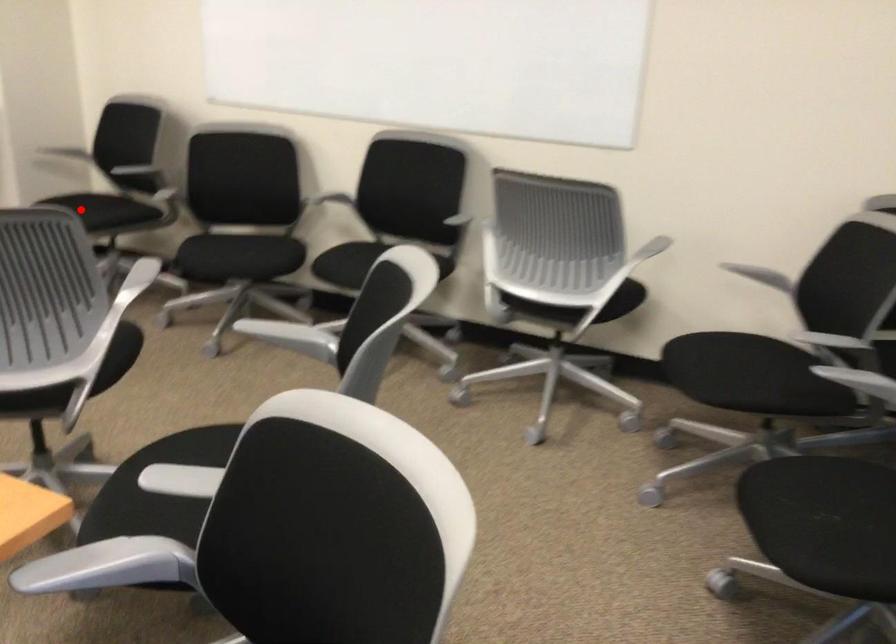
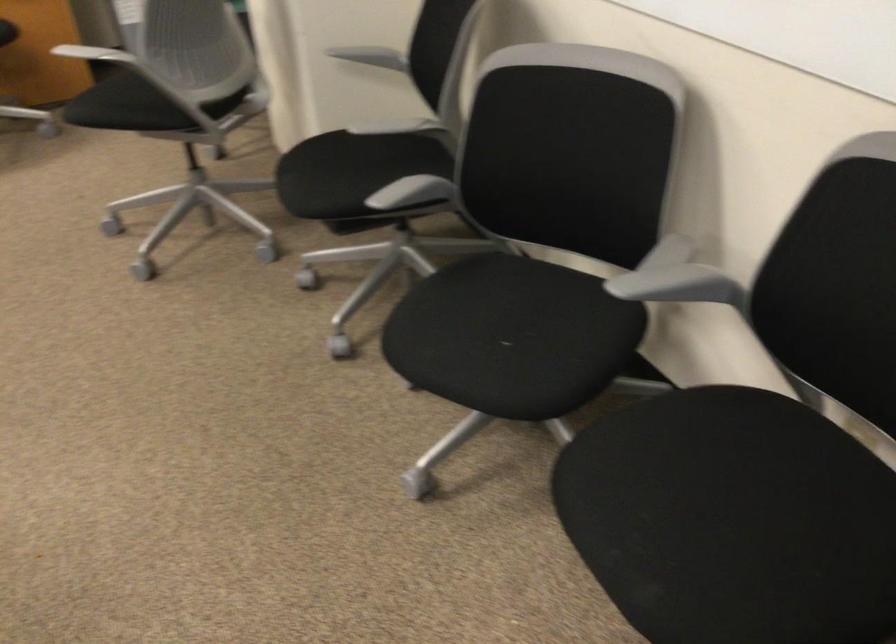
Question: I am providing you with two images of the same scene from different viewpoints. A red point is shown in image1. For the corresponding object point in image2, is it positioned nearer or farther from the camera?

Choices:
 (A) Nearer
 (B) Farther

Answer: (A)